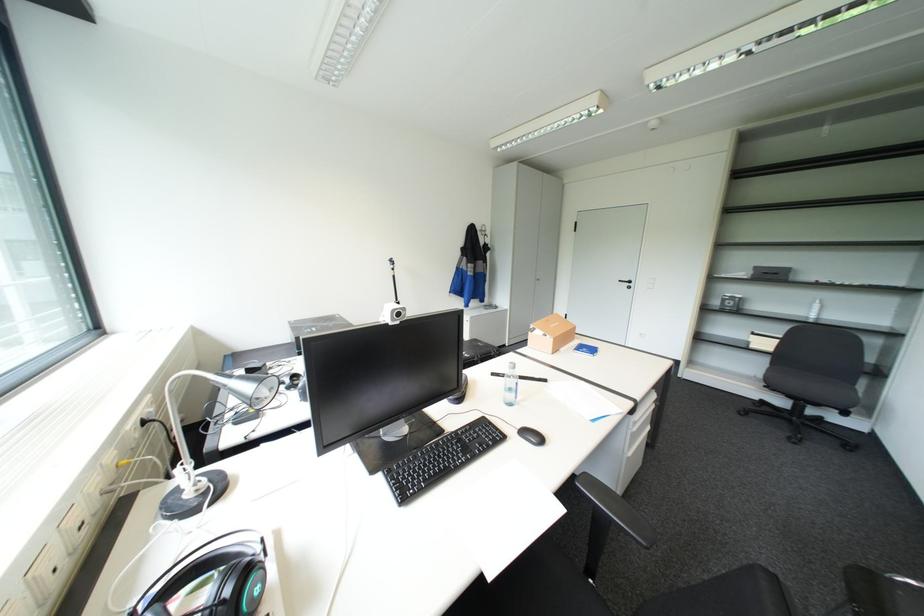
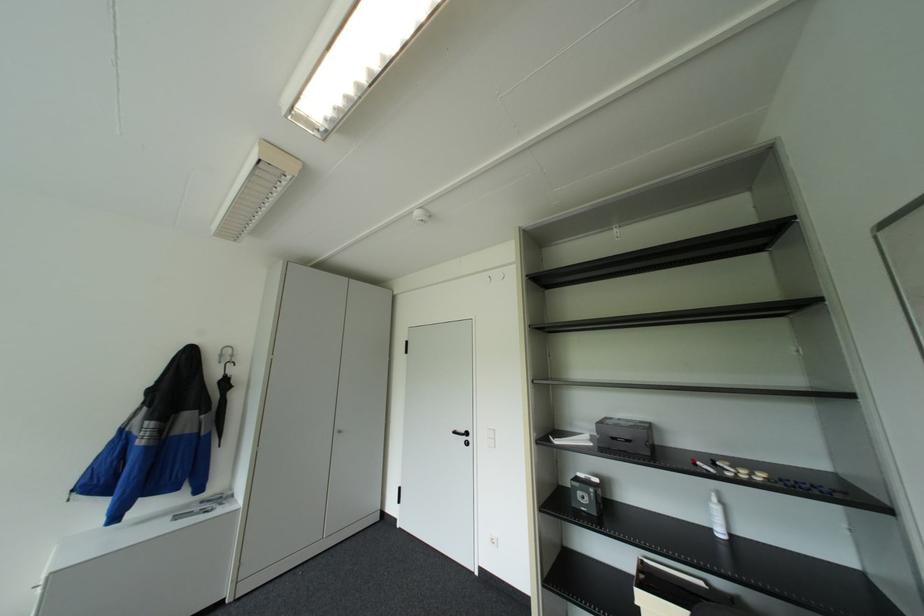
Locate, in the second image, the point that corresponds to (737,302) in the first image.

(591, 496)